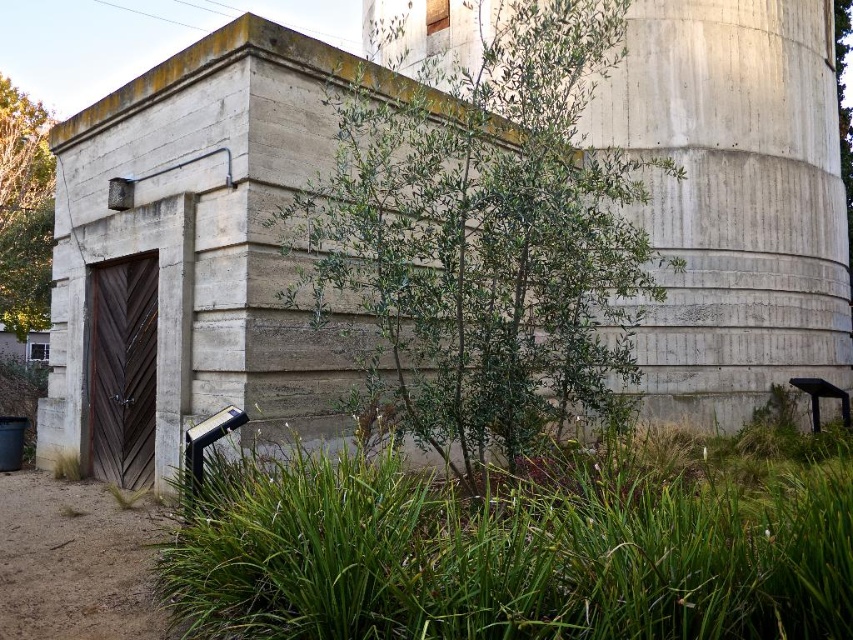
Question: Does green leafy shrub at center have a larger size compared to green leafy tree at left?

Choices:
 (A) no
 (B) yes

Answer: (A)

Question: Can you confirm if green leafy shrub at center is positioned above green leafy tree at left?

Choices:
 (A) no
 (B) yes

Answer: (A)

Question: Observing the image, what is the correct spatial positioning of green leafy shrub at center in reference to green leafy tree at left?

Choices:
 (A) below
 (B) above

Answer: (A)